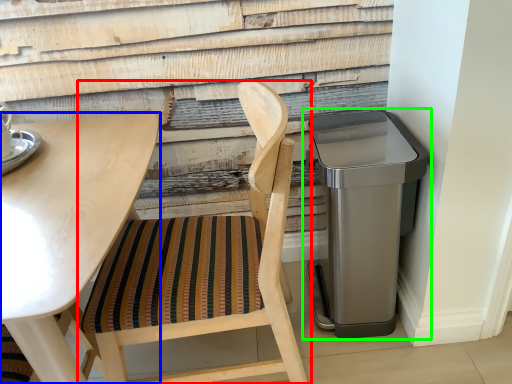
Question: Based on their relative distances, which object is farther from chair (highlighted by a red box)? Choose from table (highlighted by a blue box) and waste container (highlighted by a green box).

Choices:
 (A) table
 (B) waste container

Answer: (B)